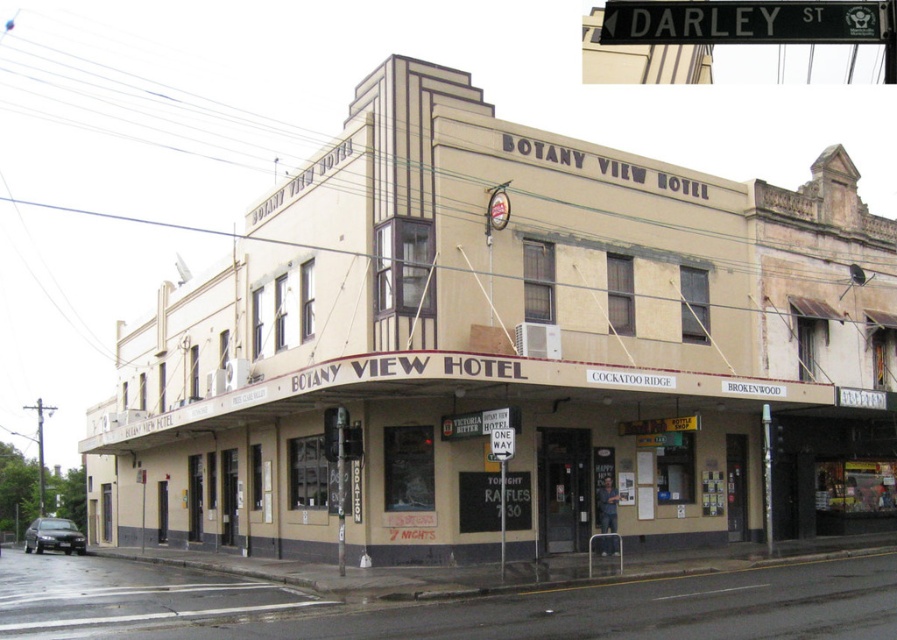
Question: Can you confirm if beige textured building at center is wider than black metal street sign at upper center?

Choices:
 (A) no
 (B) yes

Answer: (B)

Question: Is the position of beige textured building at center more distant than that of black metal street sign at upper center?

Choices:
 (A) yes
 (B) no

Answer: (A)

Question: Does beige textured building at center appear on the left side of black metal street sign at upper center?

Choices:
 (A) yes
 (B) no

Answer: (A)

Question: Which of the following is the farthest from the observer?

Choices:
 (A) (464, 232)
 (B) (646, 26)

Answer: (A)

Question: Which object is closer to the camera taking this photo?

Choices:
 (A) beige textured building at center
 (B) black metal street sign at upper center

Answer: (B)